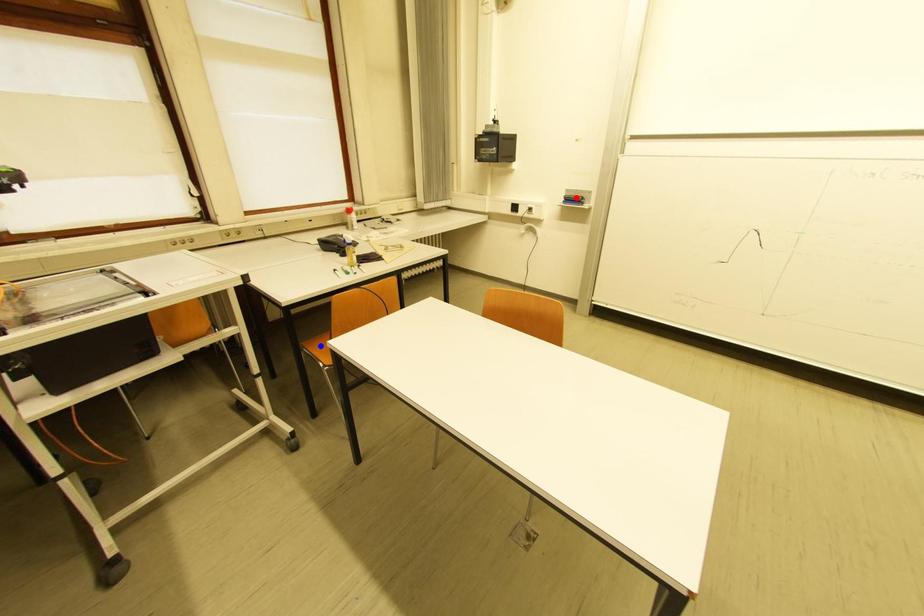
Question: In the image, two points are highlighted. Which point is nearer to the camera? Reply with the corresponding letter.

Choices:
 (A) blue point
 (B) red point

Answer: (A)